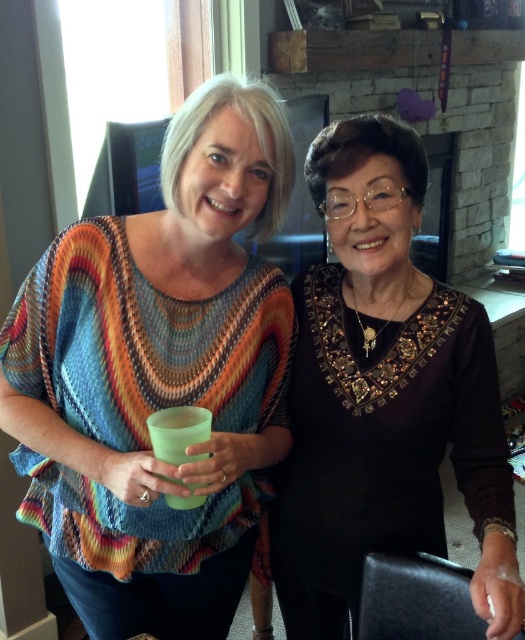
Which of these two, matte green glass at center or black sequined blouse at center, stands shorter?

With less height is matte green glass at center.

Does point (280, 371) come behind point (470, 435)?

Yes, it is behind point (470, 435).

Where is `matte green glass at center`? The image size is (525, 640). matte green glass at center is located at coordinates (159, 376).